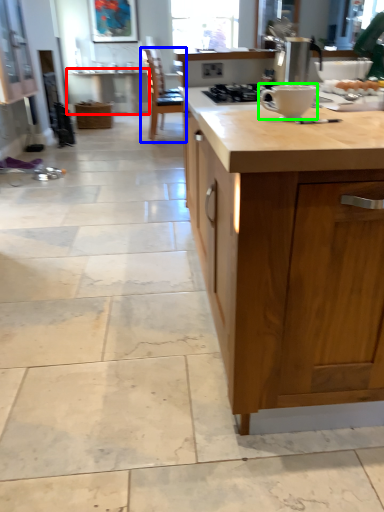
Question: Which is farther away from table (highlighted by a red box)? chair (highlighted by a blue box) or coffee cup (highlighted by a green box)?

Choices:
 (A) chair
 (B) coffee cup

Answer: (B)